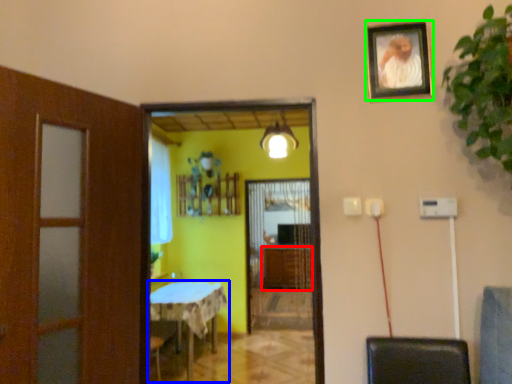
Question: Which object is the farthest from cabinetry (highlighted by a red box)? Choose among these: table (highlighted by a blue box) or picture frame (highlighted by a green box).

Choices:
 (A) table
 (B) picture frame

Answer: (B)